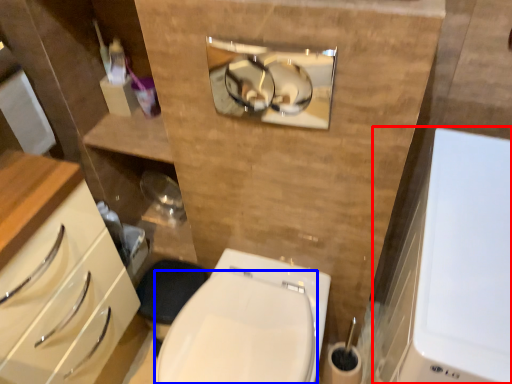
Question: Which object appears farthest to the camera in this image, medicine cabinet (highlighted by a red box) or bidet (highlighted by a blue box)?

Choices:
 (A) medicine cabinet
 (B) bidet

Answer: (B)